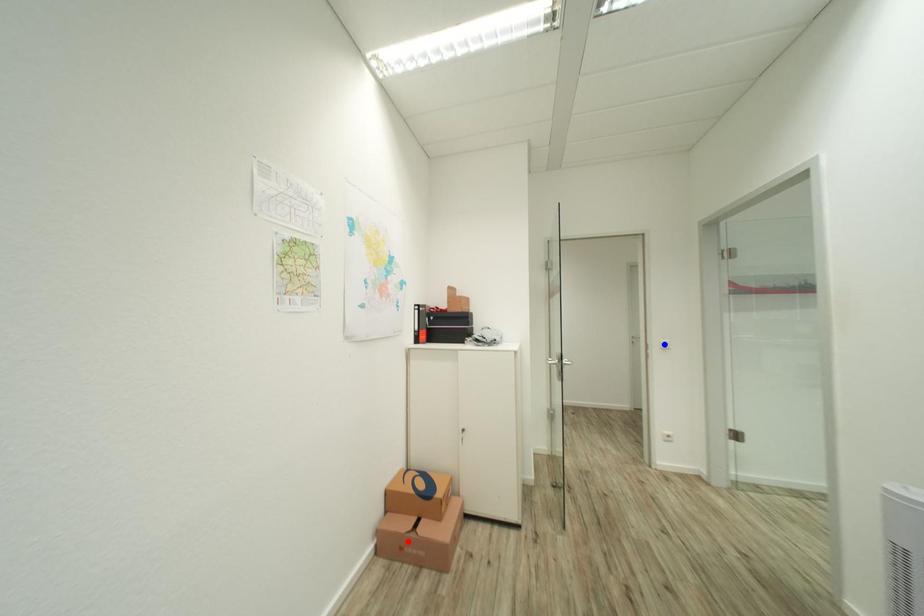
Question: In the image, two points are highlighted. Which point is nearer to the camera? Reply with the corresponding letter.

Choices:
 (A) blue point
 (B) red point

Answer: (B)